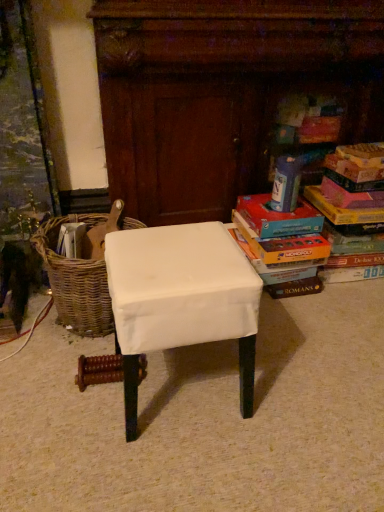
Find the location of a particular element. This screenshot has width=384, height=512. vacant space to the left of woven brown basket at left is located at coordinates 27,321.